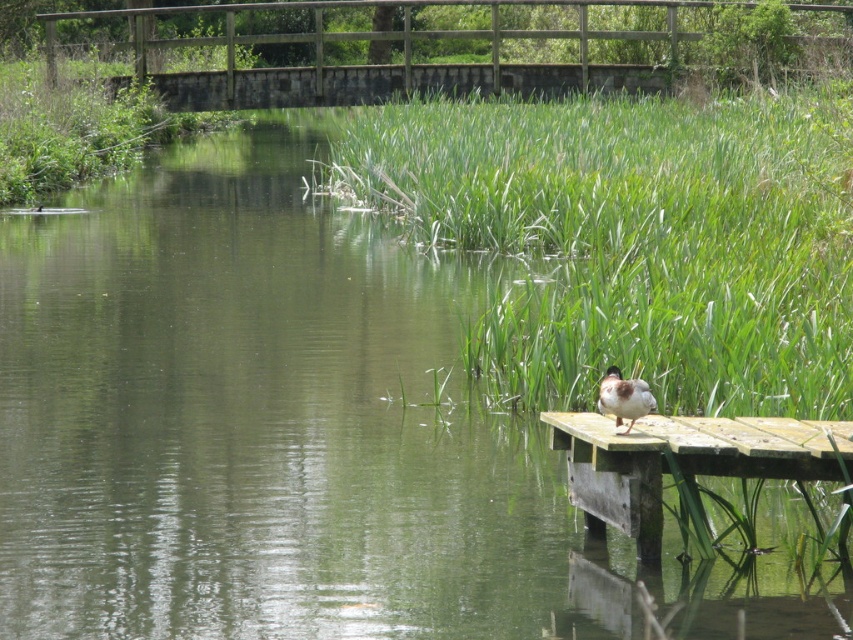
You are a photographer aiming to capture the brown feathered duck at right and the weathered wood dock at right in the same frame. Based on their positions, which object would appear closer to the camera in the photo?

The brown feathered duck at right appears closer to the camera because it is positioned above the weathered wood dock at right.

You are standing on the wooden platform and want to walk towards the wooden bridge in the background. Which point, point (604, 522) or point (601, 401), is closer to you as you face the bridge?

Point (604, 522) is closer to you because it is further to the camera than point (601, 401), meaning it is nearer to your current position on the wooden platform.